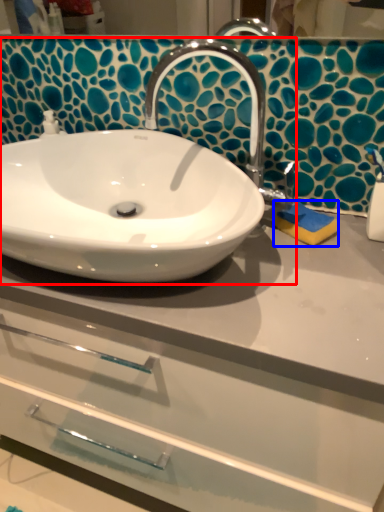
Question: Which point is further to the camera, sink (highlighted by a red box) or soap (highlighted by a blue box)?

Choices:
 (A) sink
 (B) soap

Answer: (B)